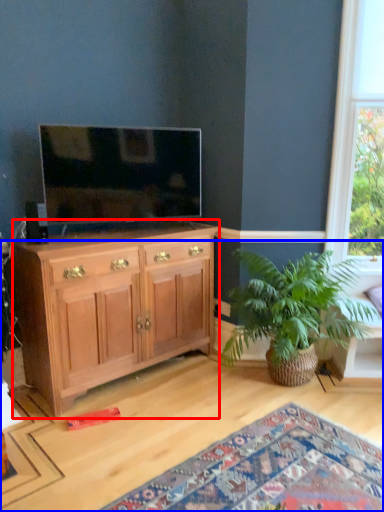
Question: Which of the following is the farthest to the observer, cabinetry (highlighted by a red box) or desk (highlighted by a blue box)?

Choices:
 (A) cabinetry
 (B) desk

Answer: (A)